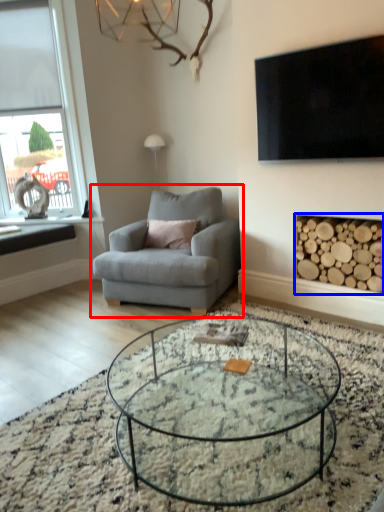
Question: Which point is further to the camera, chair (highlighted by a red box) or fireplace (highlighted by a blue box)?

Choices:
 (A) chair
 (B) fireplace

Answer: (A)